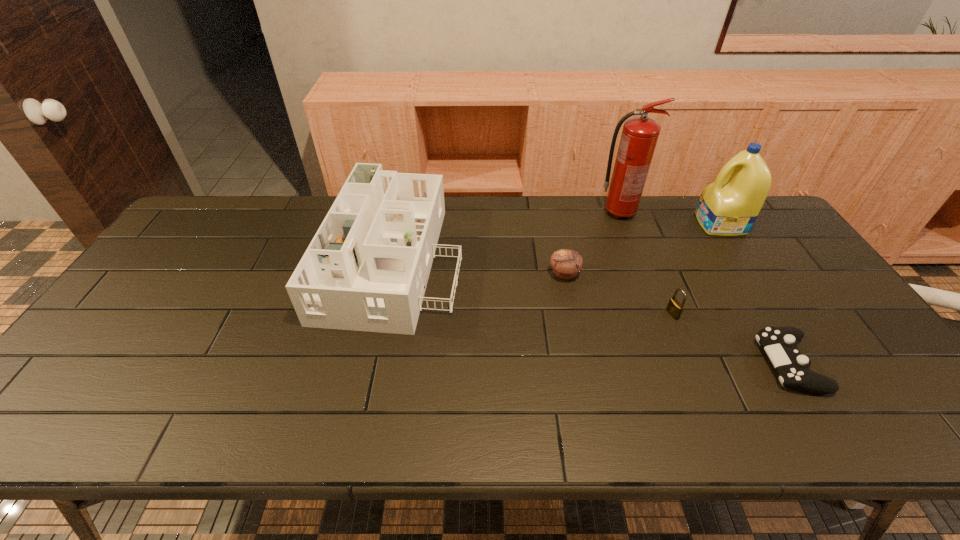
At what (x,y) coordinates should I click in order to perform the action: click on vacant region that satisfies the following two spatial constraints: 1. on the label of the detergent; 2. on the front side of the leftmost object. Please return your answer as a coordinate pair (x, y). Looking at the image, I should click on (741, 256).

At what (x,y) coordinates should I click in order to perform the action: click on free location that satisfies the following two spatial constraints: 1. on the back side of the padlock; 2. on the handle side the tallest object. Please return your answer as a coordinate pair (x, y). This screenshot has width=960, height=540. Looking at the image, I should click on (631, 213).